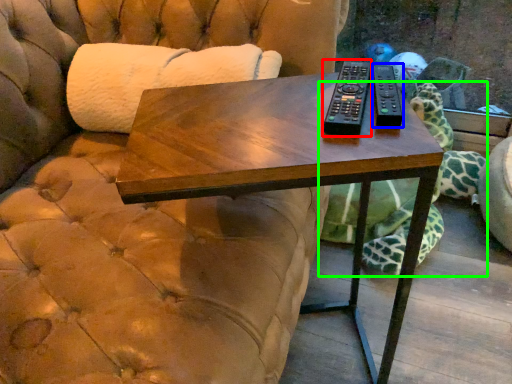
Question: Estimate the real-world distances between objects in this image. Which object is closer to remote (highlighted by a red box), remote (highlighted by a blue box) or tortoise (highlighted by a green box)?

Choices:
 (A) remote
 (B) tortoise

Answer: (A)